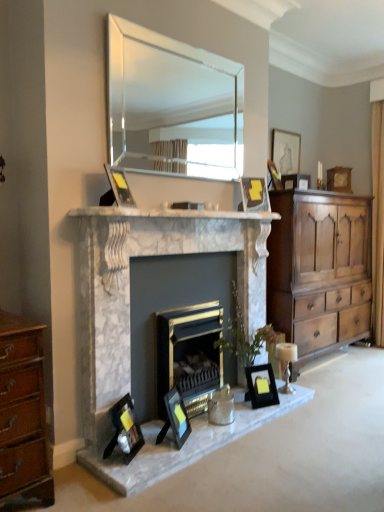
Question: Is clear glass mirror at upper center inside matte black picture frame at upper center, which is the third picture frame in back-to-front order?

Choices:
 (A) yes
 (B) no

Answer: (B)

Question: From a real-world perspective, does matte black picture frame at upper center, the sixth picture frame viewed from the left, sit lower than clear glass mirror at upper center?

Choices:
 (A) no
 (B) yes

Answer: (B)

Question: Is matte black picture frame at upper center, the sixth picture frame when ordered from bottom to top, in contact with clear glass mirror at upper center?

Choices:
 (A) yes
 (B) no

Answer: (B)

Question: Is matte black picture frame at upper center, the sixth picture frame viewed from the left, wider than clear glass mirror at upper center?

Choices:
 (A) no
 (B) yes

Answer: (B)

Question: From the image's perspective, is matte black picture frame at upper center, arranged as the 6th picture frame when viewed from the front, above clear glass mirror at upper center?

Choices:
 (A) yes
 (B) no

Answer: (B)

Question: From a real-world perspective, is gold metallic fireplace at center, which ranks as the 1th fireplace in right-to-left order, physically located above or below matte wooden picture frame at upper right, placed as the 1th picture frame when sorted from top to bottom?

Choices:
 (A) below
 (B) above

Answer: (A)

Question: Based on their sizes in the image, would you say gold metallic fireplace at center, which ranks as the 1th fireplace in right-to-left order, is bigger or smaller than matte wooden picture frame at upper right, the 7th picture frame viewed from the front?

Choices:
 (A) big
 (B) small

Answer: (A)

Question: In the image, is gold metallic fireplace at center, which ranks as the 1th fireplace in right-to-left order, positioned in front of or behind matte wooden picture frame at upper right, which is counted as the 7th picture frame, starting from the left?

Choices:
 (A) front
 (B) behind

Answer: (A)

Question: Is gold metallic fireplace at center, the second fireplace when ordered from left to right, inside the boundaries of matte wooden picture frame at upper right, which is counted as the 7th picture frame, starting from the left, or outside?

Choices:
 (A) inside
 (B) outside

Answer: (B)

Question: Considering the positions of wooden picture frame at upper right, which ranks as the second picture frame in top-to-bottom order, and white marble fireplace at center in the image, is wooden picture frame at upper right, which ranks as the second picture frame in top-to-bottom order, taller or shorter than white marble fireplace at center?

Choices:
 (A) short
 (B) tall

Answer: (B)

Question: Which is correct: wooden picture frame at upper right, acting as the first picture frame starting from the right, is inside white marble fireplace at center, or outside of it?

Choices:
 (A) outside
 (B) inside

Answer: (A)

Question: From a real-world perspective, is wooden picture frame at upper right, acting as the first picture frame starting from the right, physically located above or below white marble fireplace at center?

Choices:
 (A) below
 (B) above

Answer: (B)

Question: In the image, is wooden picture frame at upper right, acting as the first picture frame starting from the right, positioned in front of or behind white marble fireplace at center?

Choices:
 (A) behind
 (B) front

Answer: (A)

Question: Based on their sizes in the image, would you say wooden picture frame at upper right, marked as the eighth picture frame in a front-to-back arrangement, is bigger or smaller than matte black picture frame at upper center, which is the third picture frame in back-to-front order?

Choices:
 (A) big
 (B) small

Answer: (A)

Question: Would you say wooden picture frame at upper right, marked as the eighth picture frame in a front-to-back arrangement, is to the left or to the right of matte black picture frame at upper center, arranged as the 3th picture frame when viewed from the right, in the picture?

Choices:
 (A) right
 (B) left

Answer: (A)